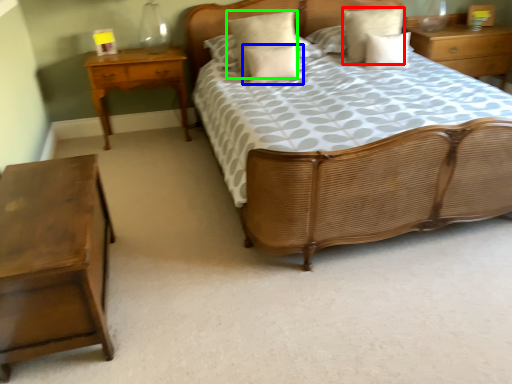
Question: Which is nearer to the pillow (highlighted by a red box)? pillow (highlighted by a blue box) or pillow (highlighted by a green box).

Choices:
 (A) pillow
 (B) pillow

Answer: (B)